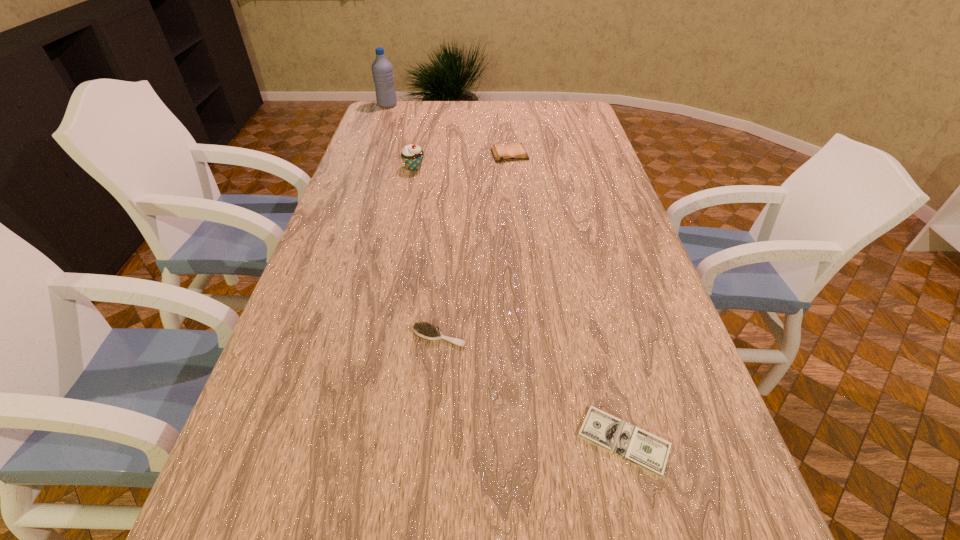
Locate an element on the screen. The image size is (960, 540). vacant space located 0.060m on the left of the fourth object from right to left is located at coordinates (385, 168).

At what (x,y) coordinates should I click in order to perform the action: click on free spot located 0.310m on the front of the fourth object from left to right. Please return your answer as a coordinate pair (x, y). Looking at the image, I should click on (516, 214).

Where is `vacant area located on the back of the scrubbing brush`? The image size is (960, 540). vacant area located on the back of the scrubbing brush is located at coordinates (444, 287).

The image size is (960, 540). I want to click on free space located on the left of the nearest object, so click(x=479, y=441).

The height and width of the screenshot is (540, 960). I want to click on object present at the far edge, so click(x=382, y=70).

Image resolution: width=960 pixels, height=540 pixels. I want to click on object that is at the left edge, so click(382, 70).

The height and width of the screenshot is (540, 960). Identify the location of object that is positioned at the right edge. (641, 448).

Locate an element on the screen. This screenshot has height=540, width=960. object positioned at the far left corner is located at coordinates (382, 70).

The height and width of the screenshot is (540, 960). In the image, there is a desktop. What are the coordinates of `vacant space at the far edge` in the screenshot? It's located at (465, 120).

Locate an element on the screen. The image size is (960, 540). vacant space at the left edge of the desktop is located at coordinates (359, 147).